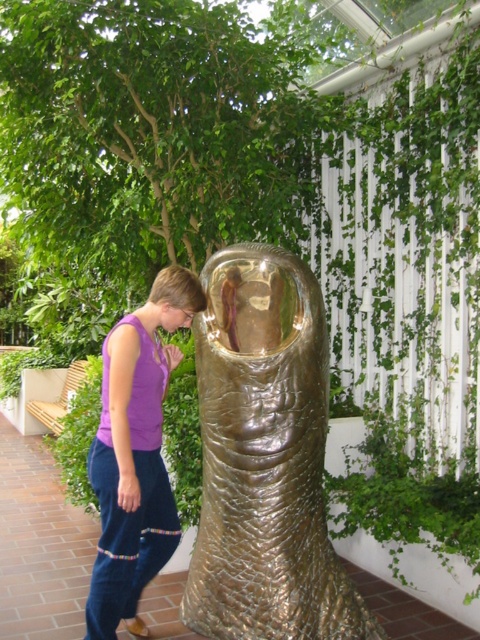
What is located at the coordinates point (264, 458) in the image?

The point (264, 458) corresponds to the gold textured fish at center.

You are a photographer trying to capture the gold textured fish at center and the purple cotton pants at lower left in the same frame. Based on their sizes, which object should you focus on first to ensure both are in clear view?

The gold textured fish at center is shorter than the purple cotton pants at lower left, so you should focus on the purple cotton pants at lower left first to ensure both are in clear view.